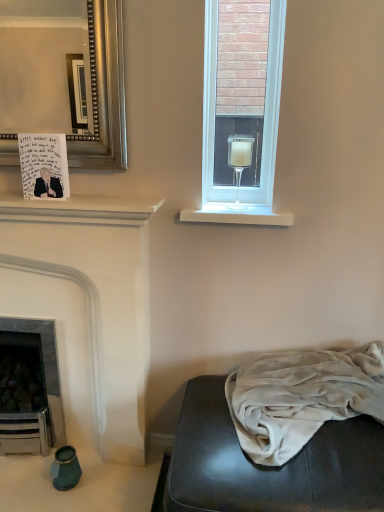
Question: Looking at their shapes, would you say clear glass candle at upper center is wider or thinner than velvet gray studio couch at lower right?

Choices:
 (A) wide
 (B) thin

Answer: (B)

Question: Based on their sizes in the image, would you say clear glass candle at upper center is bigger or smaller than velvet gray studio couch at lower right?

Choices:
 (A) small
 (B) big

Answer: (A)

Question: Estimate the real-world distances between objects in this image. Which object is farther from the white matte fireplace at left?

Choices:
 (A) white matte shelf at upper left
 (B) clear glass wine glass at upper right
 (C) clear glass candle at upper center
 (D) velvety gray blanket at lower right
 (E) velvet gray studio couch at lower right

Answer: (B)

Question: Which of these objects is positioned closest to the clear glass wine glass at upper right?

Choices:
 (A) velvet gray studio couch at lower right
 (B) white matte shelf at upper left
 (C) white smooth window sill at upper right
 (D) white matte fireplace at left
 (E) clear glass candle at upper center

Answer: (E)